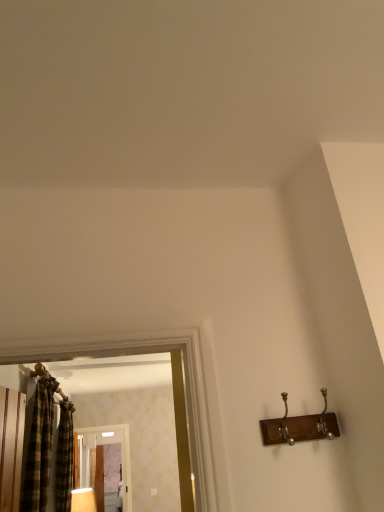
Image resolution: width=384 pixels, height=512 pixels. Describe the element at coordinates (39, 448) in the screenshot. I see `plaid fabric curtain at left` at that location.

Find the location of `clear glass screen door at center`. clear glass screen door at center is located at coordinates (121, 453).

Identify the location of screen door behind the plaid fabric shower curtain at left. (121, 453).

From the image's perspective, is clear glass screen door at center located beneath plaid fabric shower curtain at left?

Correct, clear glass screen door at center appears lower than plaid fabric shower curtain at left in the image.

Can we say clear glass screen door at center lies outside plaid fabric shower curtain at left?

Yes, clear glass screen door at center is not within plaid fabric shower curtain at left.

From a real-world perspective, is clear glass screen door at center physically below plaid fabric shower curtain at left?

Yes, from a real-world perspective, clear glass screen door at center is under plaid fabric shower curtain at left.

Between clear glass screen door at center and plaid fabric curtain at left, which one has smaller width?

clear glass screen door at center is thinner.

Considering the sizes of objects clear glass screen door at center and plaid fabric curtain at left in the image provided, who is shorter, clear glass screen door at center or plaid fabric curtain at left?

plaid fabric curtain at left is shorter.

Is point (123, 507) farther from camera compared to point (41, 380)?

Yes, point (123, 507) is behind point (41, 380).

Considering the sizes of wooden hanger at upper left and plaid fabric curtain at left in the image, is wooden hanger at upper left wider or thinner than plaid fabric curtain at left?

Considering their sizes, wooden hanger at upper left looks slimmer than plaid fabric curtain at left.

Is wooden hanger at upper left positioned with its back to plaid fabric curtain at left?

wooden hanger at upper left is not turned away from plaid fabric curtain at left.

From a real-world perspective, relative to plaid fabric curtain at left, is wooden hanger at upper left vertically above or below?

From a real-world perspective, wooden hanger at upper left is physically above plaid fabric curtain at left.

How much distance is there between plaid fabric curtain at left and matte wooden lamp at lower left?

plaid fabric curtain at left and matte wooden lamp at lower left are 37.90 inches apart from each other.

Could you tell me if plaid fabric curtain at left is facing matte wooden lamp at lower left?

No.

Between plaid fabric curtain at left and matte wooden lamp at lower left, which one has larger width?

Wider between the two is plaid fabric curtain at left.

Is plaid fabric curtain at left behind matte wooden lamp at lower left?

No, the depth of plaid fabric curtain at left is less than that of matte wooden lamp at lower left.

From a real-world perspective, who is located higher, plaid fabric shower curtain at left or clear glass screen door at center?

plaid fabric shower curtain at left is physically above.

This screenshot has height=512, width=384. What are the coordinates of `shower curtain above the clear glass screen door at center (from a real-world perspective)` in the screenshot? It's located at (64, 458).

How different are the orientations of plaid fabric shower curtain at left and clear glass screen door at center in degrees?

They differ by 88.4 degrees in their facing directions.

Who is more distant, plaid fabric shower curtain at left or clear glass screen door at center?

clear glass screen door at center.

Based on the photo, is plaid fabric shower curtain at left facing away from matte wooden lamp at lower left?

No, plaid fabric shower curtain at left is not facing away from matte wooden lamp at lower left.

Is plaid fabric shower curtain at left outside of matte wooden lamp at lower left?

Yes, plaid fabric shower curtain at left is outside of matte wooden lamp at lower left.

From the image's perspective, which is below, plaid fabric shower curtain at left or matte wooden lamp at lower left?

matte wooden lamp at lower left is shown below in the image.

Would you say plaid fabric shower curtain at left is a long distance from matte wooden lamp at lower left?

That's not correct — plaid fabric shower curtain at left is a little close to matte wooden lamp at lower left.

Considering the sizes of objects wooden hanger at upper left and matte wooden lamp at lower left in the image provided, who is thinner, wooden hanger at upper left or matte wooden lamp at lower left?

With smaller width is wooden hanger at upper left.

Which object is positioned more to the right, wooden hanger at upper left or matte wooden lamp at lower left?

matte wooden lamp at lower left.

I want to click on lamp that appears below the wooden hanger at upper left (from the image's perspective), so click(83, 500).

From the image's perspective, would you say wooden hanger at upper left is shown under matte wooden lamp at lower left?

Incorrect, from the image's perspective, wooden hanger at upper left is higher than matte wooden lamp at lower left.

Identify the location of screen door located below the plaid fabric shower curtain at left (from the image's perspective). The image size is (384, 512). (121, 453).

You are a GUI agent. You are given a task and a screenshot of the screen. Output one action in this format:
    pyautogui.click(x=<x>, y=<y>)
    Task: Click on the screen door that appears behind the plaid fabric curtain at left
    Image resolution: width=384 pixels, height=512 pixels.
    Given the screenshot: What is the action you would take?
    pyautogui.click(x=121, y=453)

From the image, which object appears to be farther from wooden hanger at upper left, clear glass screen door at center or plaid fabric curtain at left?

clear glass screen door at center lies further to wooden hanger at upper left than the other object.

Which object lies further to the anchor point wooden hanger at upper left, matte wooden lamp at lower left or clear glass screen door at center?

matte wooden lamp at lower left.

Which object lies further to the anchor point plaid fabric shower curtain at left, matte wooden lamp at lower left or wooden hanger at upper left?

Among the two, wooden hanger at upper left is located further to plaid fabric shower curtain at left.

Considering their positions, is wooden hanger at upper left positioned further to clear glass screen door at center than matte wooden lamp at lower left?

wooden hanger at upper left is positioned further to the anchor clear glass screen door at center.

Which object lies further to the anchor point plaid fabric shower curtain at left, plaid fabric curtain at left or matte wooden lamp at lower left?

matte wooden lamp at lower left is positioned further to the anchor plaid fabric shower curtain at left.

Estimate the real-world distances between objects in this image. Which object is closer to plaid fabric shower curtain at left, matte wooden lamp at lower left or clear glass screen door at center?

matte wooden lamp at lower left lies closer to plaid fabric shower curtain at left than the other object.

Consider the image. When comparing their distances from wooden hanger at upper left, does plaid fabric shower curtain at left or plaid fabric curtain at left seem further?

plaid fabric shower curtain at left.

Estimate the real-world distances between objects in this image. Which object is further from wooden hanger at upper left, clear glass screen door at center or matte wooden lamp at lower left?

matte wooden lamp at lower left is positioned further to the anchor wooden hanger at upper left.

Identify the location of hanger located between plaid fabric curtain at left and clear glass screen door at center in the depth direction. The height and width of the screenshot is (512, 384). (40, 371).

This screenshot has height=512, width=384. Find the location of `hanger between plaid fabric curtain at left and plaid fabric shower curtain at left along the z-axis`. hanger between plaid fabric curtain at left and plaid fabric shower curtain at left along the z-axis is located at coordinates (40, 371).

Locate an element on the screen. shower curtain located between plaid fabric curtain at left and clear glass screen door at center in the depth direction is located at coordinates (64, 458).

This screenshot has height=512, width=384. I want to click on shower curtain located between wooden hanger at upper left and clear glass screen door at center in the depth direction, so click(x=64, y=458).